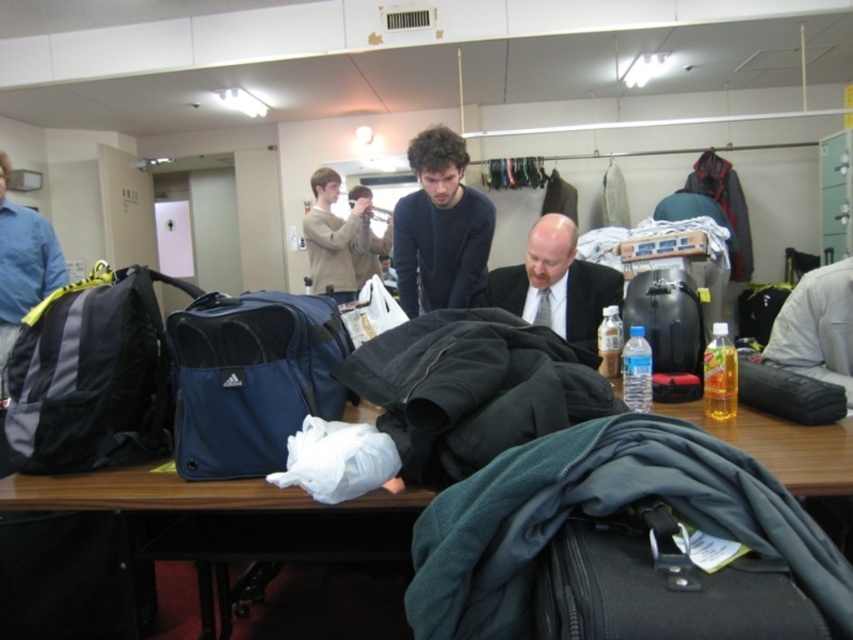
You are organizing items on the table and need to retrieve the smooth black suit at center. Can you easily access it without moving the gray fabric backpack at left?

The gray fabric backpack at left is positioned under the smooth black suit at center, so you can access the smooth black suit at center without moving the backpack since it is placed above it.

You are organizing items on the table and need to place a new item behind the translucent plastic bottle at center. Can you do this without moving the matte black suitcase at center?

The matte black suitcase at center is in front of the translucent plastic bottle at center, so you cannot place anything behind the translucent plastic bottle at center without moving the suitcase first.